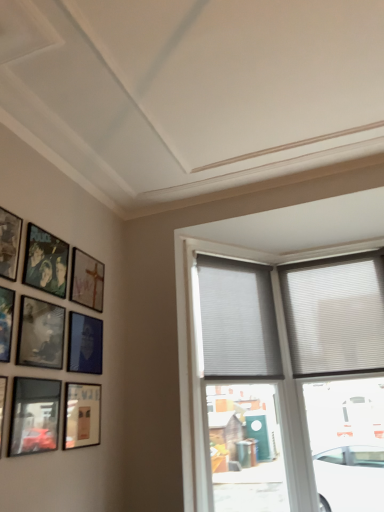
Question: Is matte blue picture frame at lower left, which ranks as the 2th picture frame in back-to-front order, turned away from metallic silver picture frame at left, which is counted as the eighth picture frame, starting from the back?

Choices:
 (A) yes
 (B) no

Answer: (B)

Question: Considering the relative positions of matte blue picture frame at lower left, which ranks as the 2th picture frame in back-to-front order, and metallic silver picture frame at left, marked as the second picture frame in a front-to-back arrangement, in the image provided, is matte blue picture frame at lower left, which ranks as the 2th picture frame in back-to-front order, behind metallic silver picture frame at left, marked as the second picture frame in a front-to-back arrangement,?

Choices:
 (A) no
 (B) yes

Answer: (B)

Question: Does matte blue picture frame at lower left, which ranks as the 2th picture frame in back-to-front order, contain metallic silver picture frame at left, marked as the second picture frame in a front-to-back arrangement?

Choices:
 (A) yes
 (B) no

Answer: (B)

Question: From the image's perspective, is matte blue picture frame at lower left, placed as the eighth picture frame when sorted from front to back, over metallic silver picture frame at left, which is counted as the eighth picture frame, starting from the back?

Choices:
 (A) no
 (B) yes

Answer: (A)

Question: Can you confirm if matte blue picture frame at lower left, which ranks as the 2th picture frame in back-to-front order, is wider than metallic silver picture frame at left, marked as the second picture frame in a front-to-back arrangement?

Choices:
 (A) yes
 (B) no

Answer: (B)

Question: In the image, is matte black picture frame at upper left, which is the 4th picture frame from back to front, positioned in front of or behind matte gold picture frame at lower left, the seventh picture frame when ordered from front to back?

Choices:
 (A) front
 (B) behind

Answer: (A)

Question: From a real-world perspective, is matte black picture frame at upper left, which is the 4th picture frame from back to front, positioned above or below matte gold picture frame at lower left, the seventh picture frame when ordered from front to back?

Choices:
 (A) below
 (B) above

Answer: (B)

Question: Is point (46, 285) closer or farther from the camera than point (94, 435)?

Choices:
 (A) farther
 (B) closer

Answer: (B)

Question: Based on their sizes in the image, would you say matte black picture frame at upper left, positioned as the 6th picture frame in front-to-back order, is bigger or smaller than matte gold picture frame at lower left, the seventh picture frame when ordered from front to back?

Choices:
 (A) small
 (B) big

Answer: (A)

Question: Choose the correct answer: Is metallic silver picture frame at left, marked as the second picture frame in a front-to-back arrangement, inside wooden frame at upper left, marked as the 1th picture frame in a back-to-front arrangement, or outside it?

Choices:
 (A) inside
 (B) outside

Answer: (B)

Question: Looking at their shapes, would you say metallic silver picture frame at left, which is counted as the eighth picture frame, starting from the back, is wider or thinner than wooden frame at upper left, the 9th picture frame in the front-to-back sequence?

Choices:
 (A) thin
 (B) wide

Answer: (B)

Question: Considering the positions of metallic silver picture frame at left, which is counted as the eighth picture frame, starting from the back, and wooden frame at upper left, the 9th picture frame in the front-to-back sequence, in the image, is metallic silver picture frame at left, which is counted as the eighth picture frame, starting from the back, taller or shorter than wooden frame at upper left, the 9th picture frame in the front-to-back sequence,?

Choices:
 (A) tall
 (B) short

Answer: (A)

Question: Is metallic silver picture frame at left, which is counted as the eighth picture frame, starting from the back, to the left or to the right of wooden frame at upper left, marked as the 1th picture frame in a back-to-front arrangement, in the image?

Choices:
 (A) left
 (B) right

Answer: (A)

Question: Visually, is white pleated blinds at upper center, the 3th window in the right-to-left sequence, positioned to the left or to the right of metallic silver picture frame at left, which is counted as the eighth picture frame, starting from the back?

Choices:
 (A) right
 (B) left

Answer: (A)

Question: In terms of width, does white pleated blinds at upper center, the 1th window positioned from the left, look wider or thinner when compared to metallic silver picture frame at left, which is counted as the eighth picture frame, starting from the back?

Choices:
 (A) thin
 (B) wide

Answer: (B)